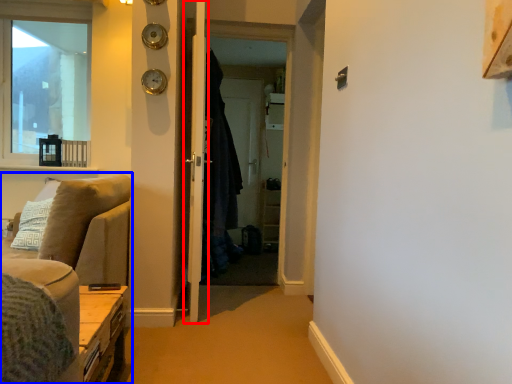
Question: Among these objects, which one is farthest to the camera, door (highlighted by a red box) or studio couch (highlighted by a blue box)?

Choices:
 (A) door
 (B) studio couch

Answer: (A)